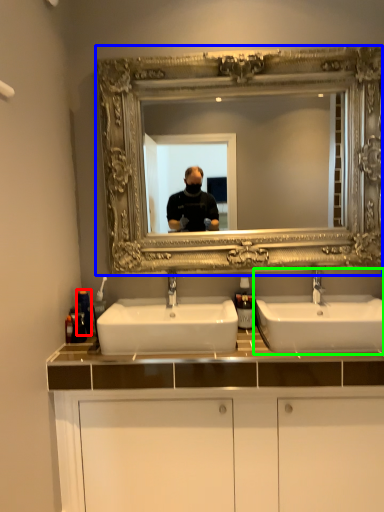
Question: Considering the real-world distances, which object is farthest from toiletry (highlighted by a red box)? medicine cabinet (highlighted by a blue box) or sink (highlighted by a green box)?

Choices:
 (A) medicine cabinet
 (B) sink

Answer: (B)